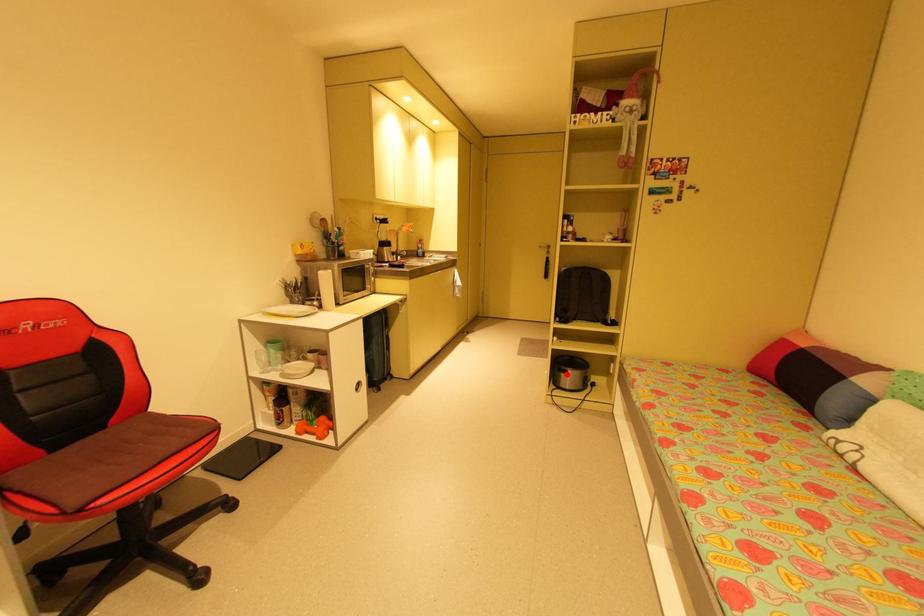
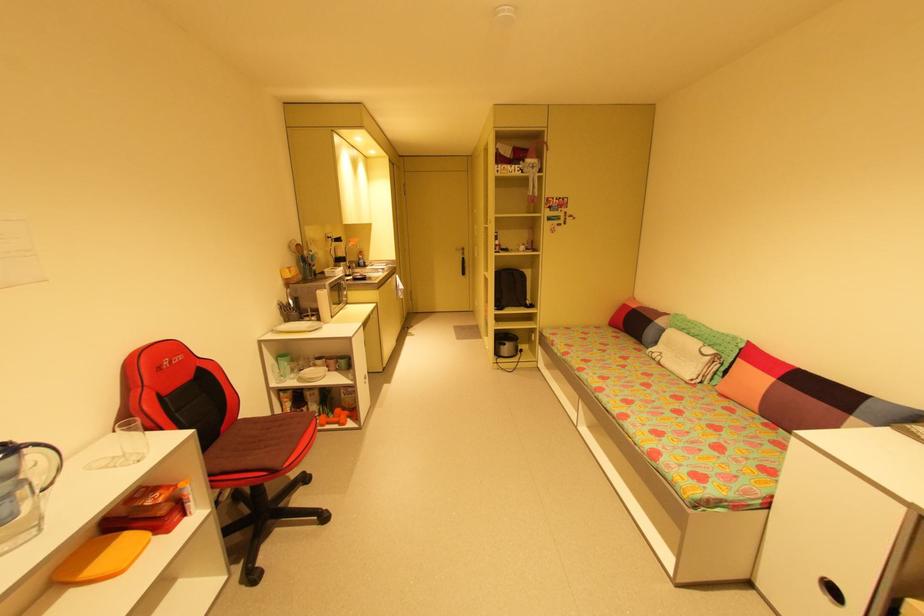
Question: I am providing you with two images of the same scene from different viewpoints. A red point is shown in image1. For the corresponding object point in image2, is it positioned nearer or farther from the camera?

Choices:
 (A) Nearer
 (B) Farther

Answer: (B)